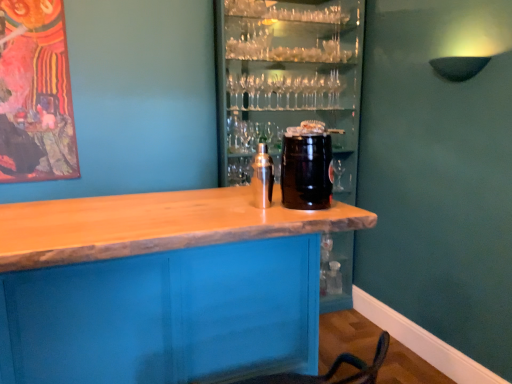
Identify the location of empty space that is to the right of satin silver shaker at center, the first beverage in the left-to-right sequence. (315, 208).